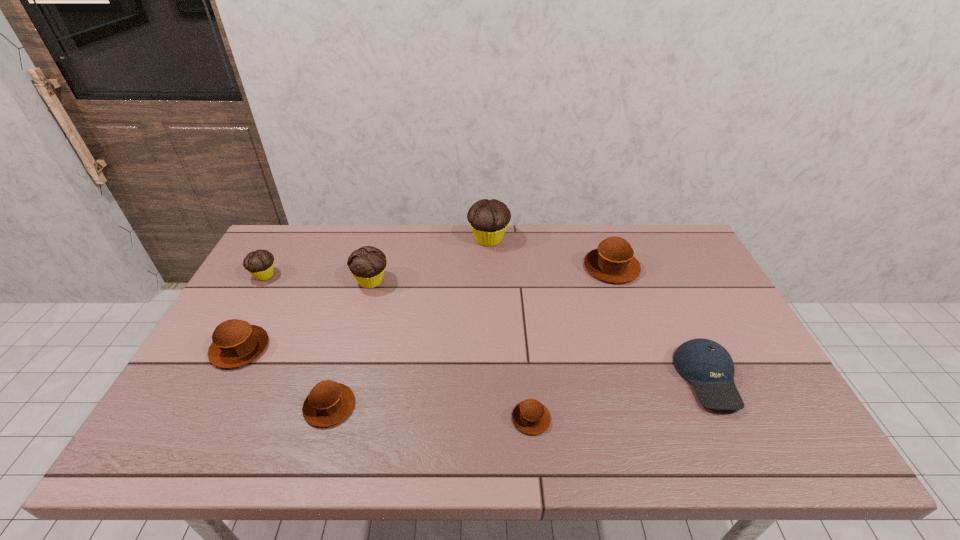
Identify the location of vacant space in between the rightmost brown muffin and the shortest muffin. The image size is (960, 540). (571, 342).

Find the location of a particular element. This screenshot has height=540, width=960. vacant space that's between the shortest object and the baseball cap is located at coordinates click(619, 398).

Locate an element on the screen. vacant area between the biggest brown muffin and the second biggest brown muffin is located at coordinates (425, 307).

Find the location of `vacant space in between the second brown muffin from left to right and the second biggest chocolate muffin`. vacant space in between the second brown muffin from left to right and the second biggest chocolate muffin is located at coordinates (350, 343).

The width and height of the screenshot is (960, 540). What are the coordinates of `vacant area that lies between the blue baseball cap and the smallest brown muffin` in the screenshot? It's located at (619, 398).

Identify the location of blank region between the blue baseball cap and the tallest muffin. (598, 308).

I want to click on unoccupied area between the baseball cap and the second brown muffin from left to right, so click(518, 392).

In order to click on blank region between the second brown muffin from left to right and the second smallest chocolate muffin in this screenshot , I will do `click(350, 343)`.

Choose which object is the nearest neighbor to the second smallest chocolate muffin. Please provide its 2D coordinates. Your answer should be formatted as a tuple, i.e. [(x, y)], where the tuple contains the x and y coordinates of a point satisfying the conditions above.

[(235, 343)]

Point out which object is positioned as the sixth nearest to the leftmost chocolate muffin. Please provide its 2D coordinates. Your answer should be formatted as a tuple, i.e. [(x, y)], where the tuple contains the x and y coordinates of a point satisfying the conditions above.

[(613, 261)]